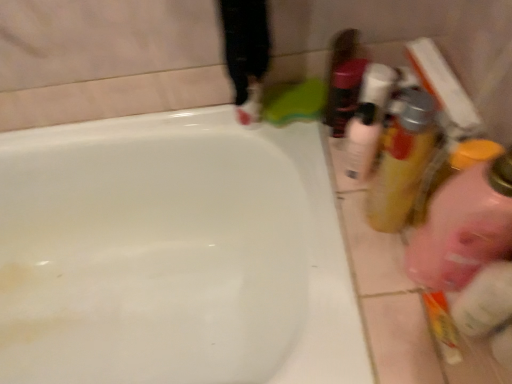
Question: From the image's perspective, does translucent plastic mouthwash at right, which ranks as the second mouthwash in left-to-right order, appear lower than pink translucent bottle at right?

Choices:
 (A) no
 (B) yes

Answer: (A)

Question: Considering the relative positions of translucent plastic mouthwash at right, which ranks as the second mouthwash in left-to-right order, and pink translucent bottle at right in the image provided, is translucent plastic mouthwash at right, which ranks as the second mouthwash in left-to-right order, to the left of pink translucent bottle at right from the viewer's perspective?

Choices:
 (A) no
 (B) yes

Answer: (B)

Question: Could you tell me if translucent plastic mouthwash at right, which ranks as the second mouthwash in left-to-right order, is turned towards pink translucent bottle at right?

Choices:
 (A) yes
 (B) no

Answer: (B)

Question: From a real-world perspective, is translucent plastic mouthwash at right, the 1th mouthwash when ordered from right to left, positioned over pink translucent bottle at right based on gravity?

Choices:
 (A) no
 (B) yes

Answer: (A)

Question: Is translucent plastic mouthwash at right, which ranks as the second mouthwash in left-to-right order, thinner than pink translucent bottle at right?

Choices:
 (A) no
 (B) yes

Answer: (B)

Question: From a real-world perspective, is white glossy bathtub at upper center positioned above or below pink translucent bottle at right?

Choices:
 (A) above
 (B) below

Answer: (B)

Question: In the image, is white glossy bathtub at upper center positioned in front of or behind pink translucent bottle at right?

Choices:
 (A) behind
 (B) front

Answer: (A)

Question: Is white glossy bathtub at upper center taller or shorter than pink translucent bottle at right?

Choices:
 (A) short
 (B) tall

Answer: (B)

Question: Which is correct: white glossy bathtub at upper center is inside pink translucent bottle at right, or outside of it?

Choices:
 (A) outside
 (B) inside

Answer: (A)

Question: From a real-world perspective, is translucent plastic bottle at upper right positioned above or below white glossy mouthwash at upper right, which ranks as the 2th mouthwash in right-to-left order?

Choices:
 (A) above
 (B) below

Answer: (A)

Question: Relative to white glossy mouthwash at upper right, which ranks as the 2th mouthwash in right-to-left order, is translucent plastic bottle at upper right in front or behind?

Choices:
 (A) front
 (B) behind

Answer: (B)

Question: Would you say translucent plastic bottle at upper right is to the left or to the right of white glossy mouthwash at upper right, which ranks as the 2th mouthwash in right-to-left order, in the picture?

Choices:
 (A) right
 (B) left

Answer: (B)

Question: From the image's perspective, is translucent plastic bottle at upper right positioned above or below white glossy mouthwash at upper right, which ranks as the 2th mouthwash in right-to-left order?

Choices:
 (A) below
 (B) above

Answer: (B)

Question: Looking at their shapes, would you say pink translucent bottle at right is wider or thinner than translucent plastic mouthwash at right, which ranks as the second mouthwash in left-to-right order?

Choices:
 (A) thin
 (B) wide

Answer: (B)

Question: From the image's perspective, relative to translucent plastic mouthwash at right, which ranks as the second mouthwash in left-to-right order, is pink translucent bottle at right above or below?

Choices:
 (A) above
 (B) below

Answer: (B)